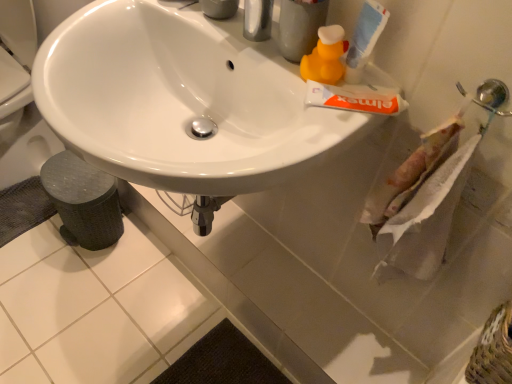
Where is `vacant space in front of gray textured bath mat at lower left`? vacant space in front of gray textured bath mat at lower left is located at coordinates (27, 269).